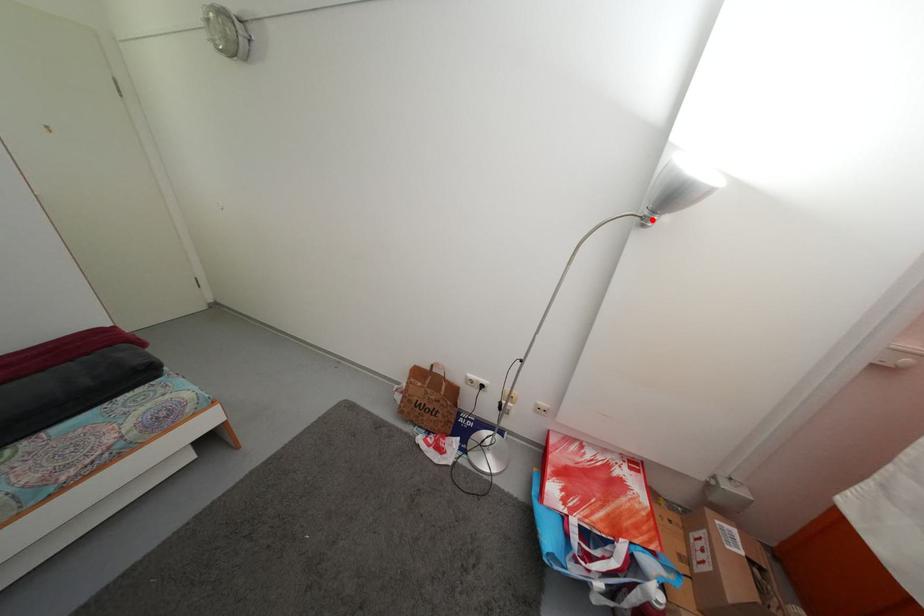
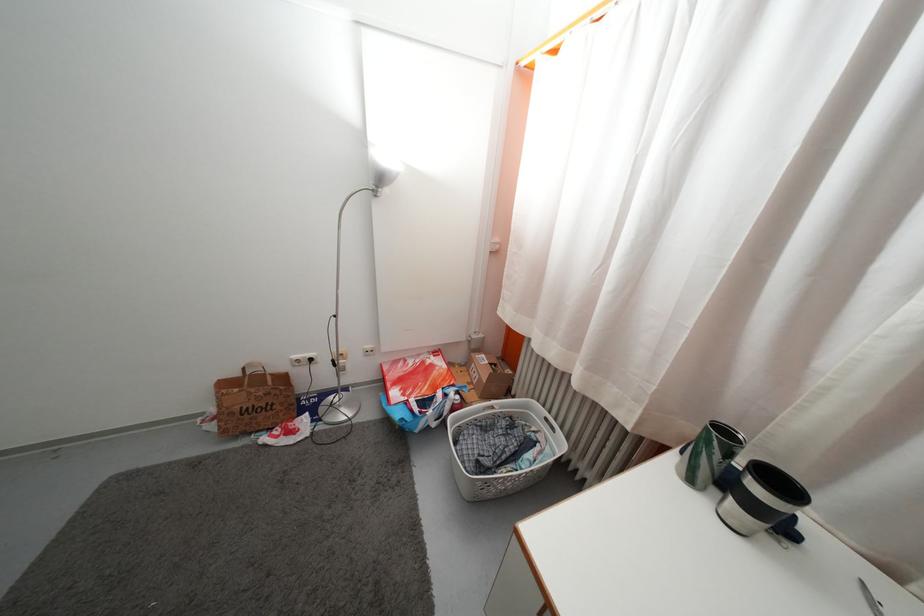
In the second image, find the point that corresponds to the highlighted location in the first image.

(379, 195)